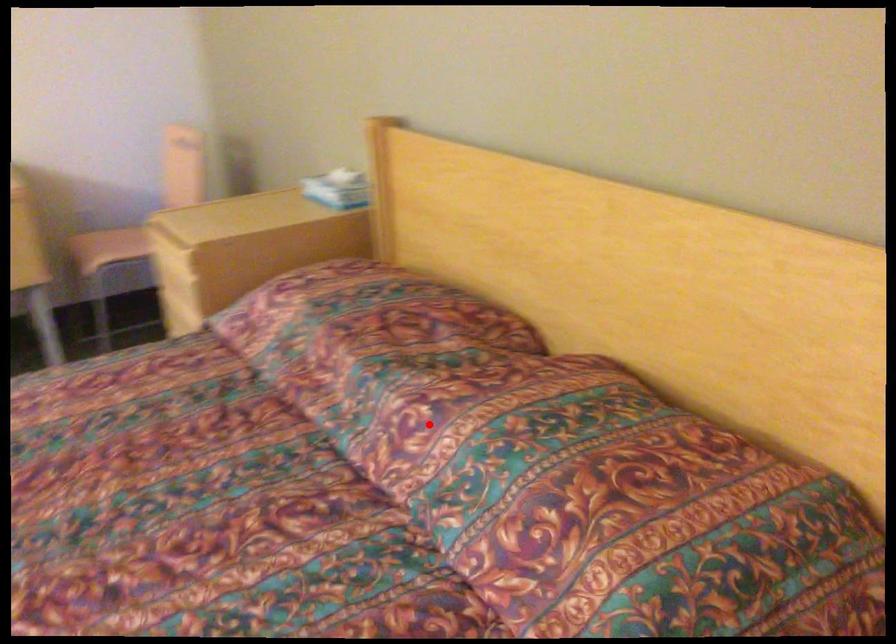
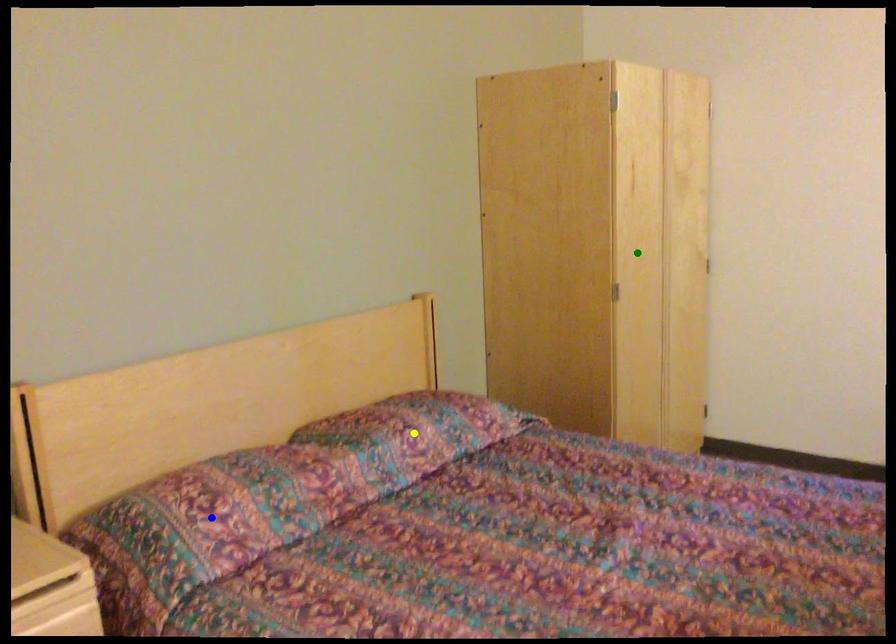
Question: I am providing you with two images of the same scene from different viewpoints. A red point is marked on the first image. You are given multiple points on the second image. Which spot in image 2 lines up with the point in image 1?

Choices:
 (A) blue point
 (B) yellow point
 (C) green point

Answer: (B)